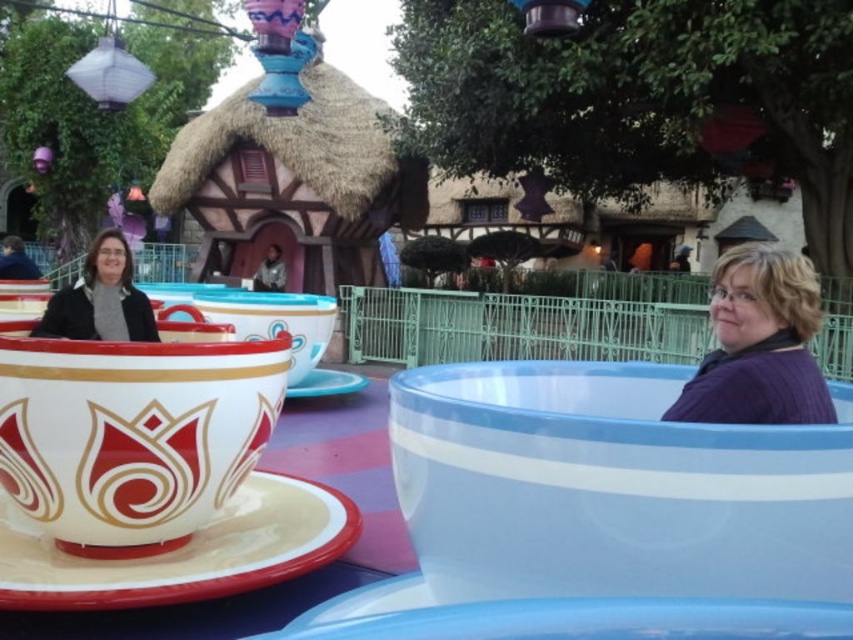
You are a guest at the theme park and want to choose a sweater to match your outfit. You see the purple knit sweater at right and the matte black sweater at left. Which sweater is located to the right side of the other?

The purple knit sweater at right is located to the right of the matte black sweater at left according to the description.

You are standing in the theme park ride area and see the purple knit sweater at right. If you want to reach it without moving your feet, can you do so with your arm fully extended?

The purple knit sweater at right is 8.01 feet away from the viewer. Since the average human arm length is about 2.5 feet, you cannot reach it without moving your feet.